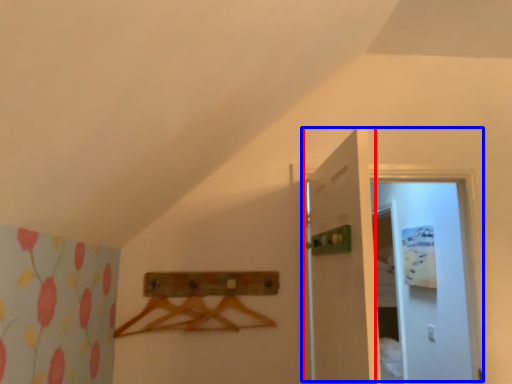
Question: Which object appears farthest to the camera in this image, door (highlighted by a red box) or door (highlighted by a blue box)?

Choices:
 (A) door
 (B) door

Answer: (B)